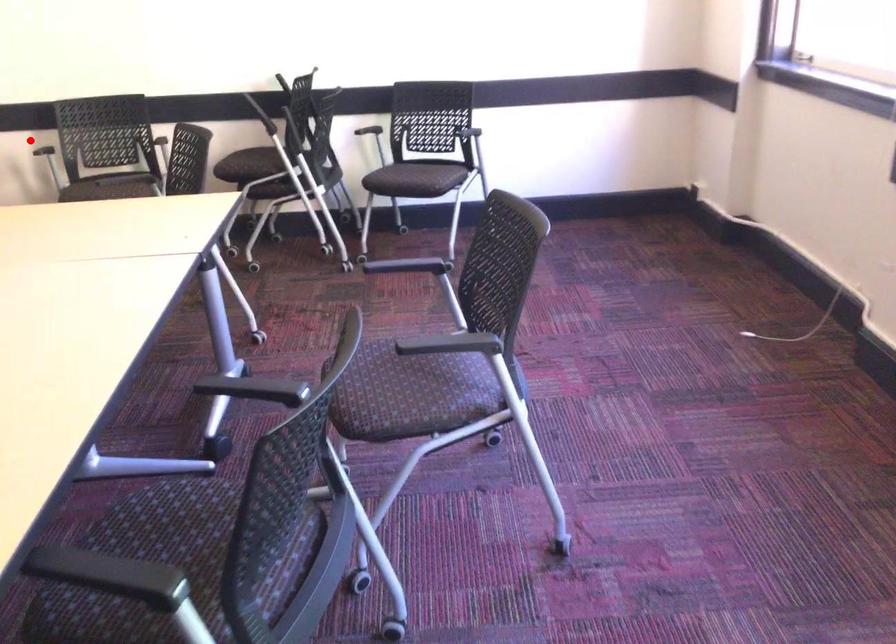
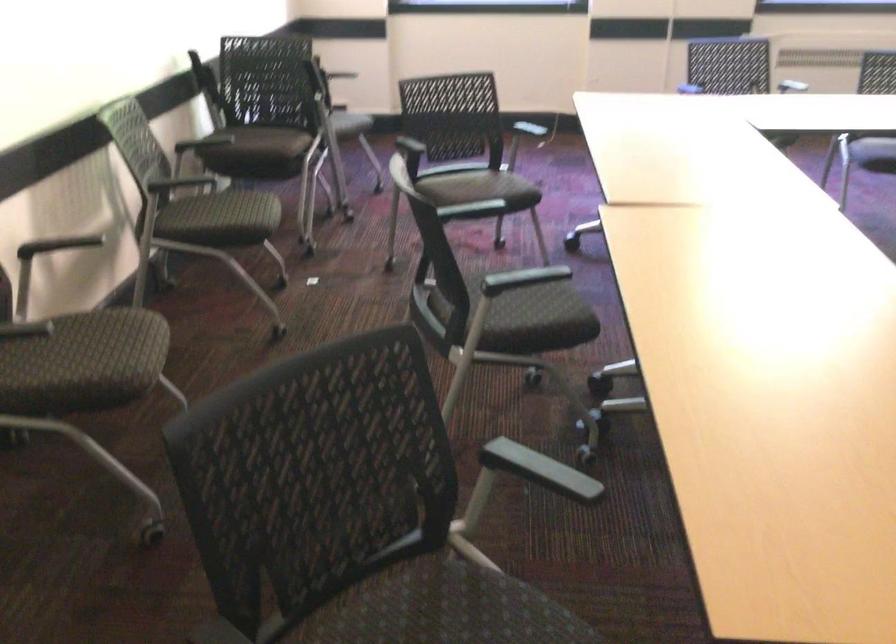
Question: I am providing you with two images of the same scene from different viewpoints. A red point is marked on the first image. Is the red point's position out of view in image 2?

Choices:
 (A) Yes
 (B) No

Answer: (A)